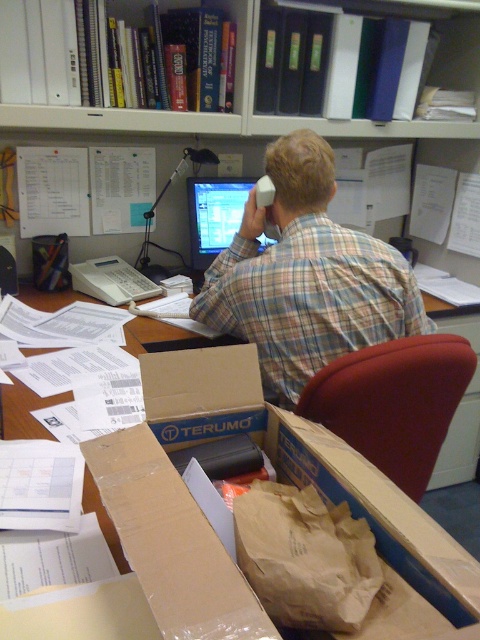
Question: Where is brown cardboard box at center located in relation to matte plastic monitor at center in the image?

Choices:
 (A) left
 (B) right

Answer: (B)

Question: Which point is closer to the camera?

Choices:
 (A) (210, 420)
 (B) (232, 189)

Answer: (A)

Question: Among these objects, which one is farthest from the camera?

Choices:
 (A) brown cardboard box at center
 (B) matte plastic monitor at center
 (C) black plastic bookshelf at upper center

Answer: (B)

Question: Which of these objects is positioned closest to the plaid shirt at center?

Choices:
 (A) black plastic bookshelf at upper center
 (B) matte plastic monitor at center

Answer: (B)

Question: In this image, where is plaid shirt at center located relative to black plastic bookshelf at upper center?

Choices:
 (A) right
 (B) left

Answer: (A)

Question: Does black plastic bookshelf at upper center lie in front of matte plastic monitor at center?

Choices:
 (A) no
 (B) yes

Answer: (B)